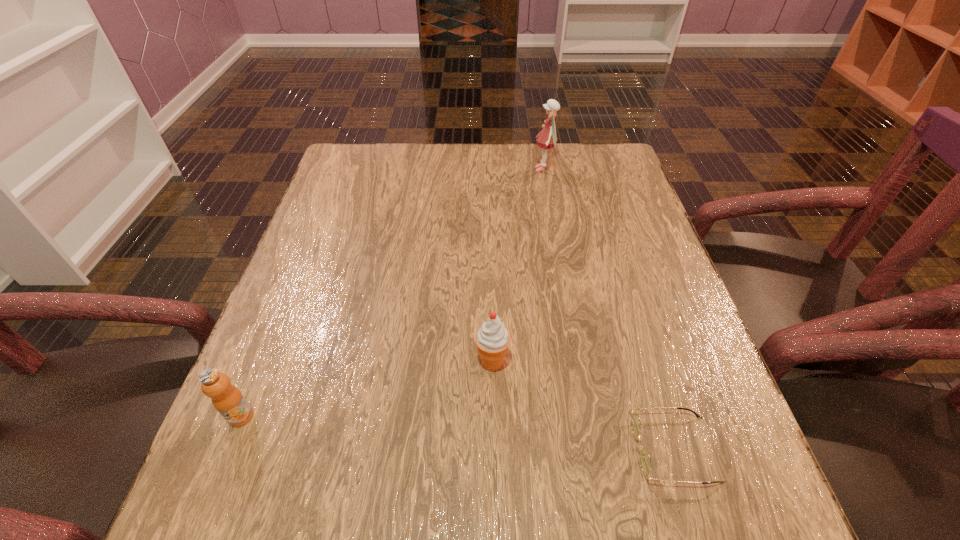
Where is `unoccupied position between the tallest object and the orange juice`? unoccupied position between the tallest object and the orange juice is located at coordinates (393, 293).

The image size is (960, 540). In order to click on blank region between the leftmost object and the third nearest object in this screenshot , I will do click(x=367, y=389).

This screenshot has height=540, width=960. Find the location of `vacant area that lies between the leftmost object and the icecream`. vacant area that lies between the leftmost object and the icecream is located at coordinates (367, 389).

The width and height of the screenshot is (960, 540). Find the location of `blank region between the second object from right to left and the third nearest object`. blank region between the second object from right to left and the third nearest object is located at coordinates (517, 266).

Find the location of a particular element. free space between the rightmost object and the tallest object is located at coordinates (609, 309).

You are a GUI agent. You are given a task and a screenshot of the screen. Output one action in this format:
    pyautogui.click(x=<x>, y=<y>)
    Task: Click on the unoccupied position between the third object from left to right and the second object from left to right
    This screenshot has width=960, height=540.
    Given the screenshot: What is the action you would take?
    pyautogui.click(x=517, y=266)

The height and width of the screenshot is (540, 960). In order to click on object that can be found as the closest to the orange juice in this screenshot , I will do `click(492, 339)`.

Select which object is the closest to the icecream. Please provide its 2D coordinates. Your answer should be formatted as a tuple, i.e. [(x, y)], where the tuple contains the x and y coordinates of a point satisfying the conditions above.

[(645, 461)]

Where is `vacant space that satisfies the following two spatial constraints: 1. on the front-facing side of the farthest object; 2. on the front label of the leftmost object`? Image resolution: width=960 pixels, height=540 pixels. vacant space that satisfies the following two spatial constraints: 1. on the front-facing side of the farthest object; 2. on the front label of the leftmost object is located at coordinates (588, 416).

Locate an element on the screen. This screenshot has width=960, height=540. free location that satisfies the following two spatial constraints: 1. on the front-facing side of the doll; 2. on the front label of the leftmost object is located at coordinates (588, 416).